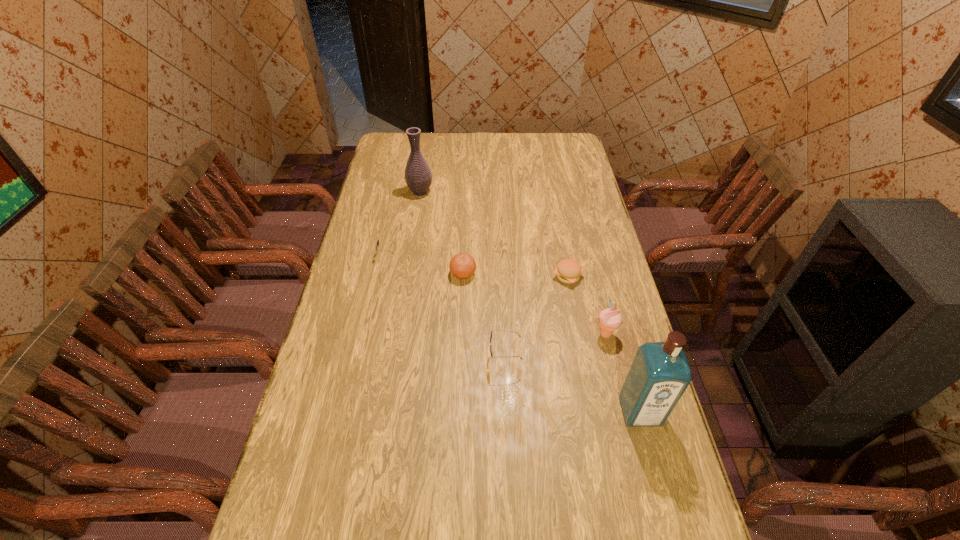
Identify the location of icecream positioned at the right edge. The width and height of the screenshot is (960, 540). (610, 319).

I want to click on liquor located at the right edge, so click(x=660, y=373).

The image size is (960, 540). Identify the location of hamburger present at the right edge. (568, 271).

You are a GUI agent. You are given a task and a screenshot of the screen. Output one action in this format:
    pyautogui.click(x=<x>, y=<y>)
    Task: Click on the vacant area at the far edge of the desktop
    The width and height of the screenshot is (960, 540).
    Given the screenshot: What is the action you would take?
    pyautogui.click(x=497, y=135)

The width and height of the screenshot is (960, 540). In the image, there is a desktop. Identify the location of free space at the near edge. (416, 500).

You are a GUI agent. You are given a task and a screenshot of the screen. Output one action in this format:
    pyautogui.click(x=<x>, y=<y>)
    Task: Click on the vacant space at the left edge
    
    Given the screenshot: What is the action you would take?
    pyautogui.click(x=394, y=179)

Identify the location of vacant space at the right edge of the desktop. (564, 199).

Identify the location of vacant space at the far left corner of the desktop. (388, 158).

In order to click on vacant region at the far right corner in this screenshot , I will do `click(572, 137)`.

The image size is (960, 540). Find the location of `free space at the near right corner of the desktop`. free space at the near right corner of the desktop is located at coordinates (645, 501).